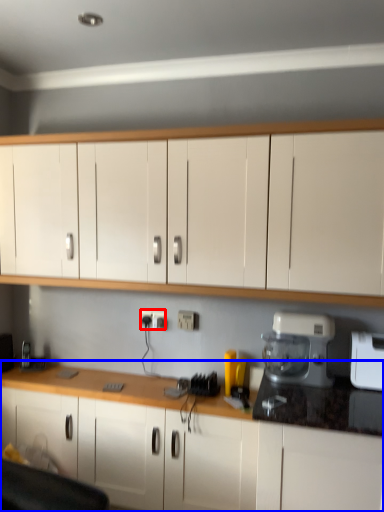
Question: Which point is closer to the camera, electric outlet (highlighted by a red box) or cabinetry (highlighted by a blue box)?

Choices:
 (A) electric outlet
 (B) cabinetry

Answer: (B)